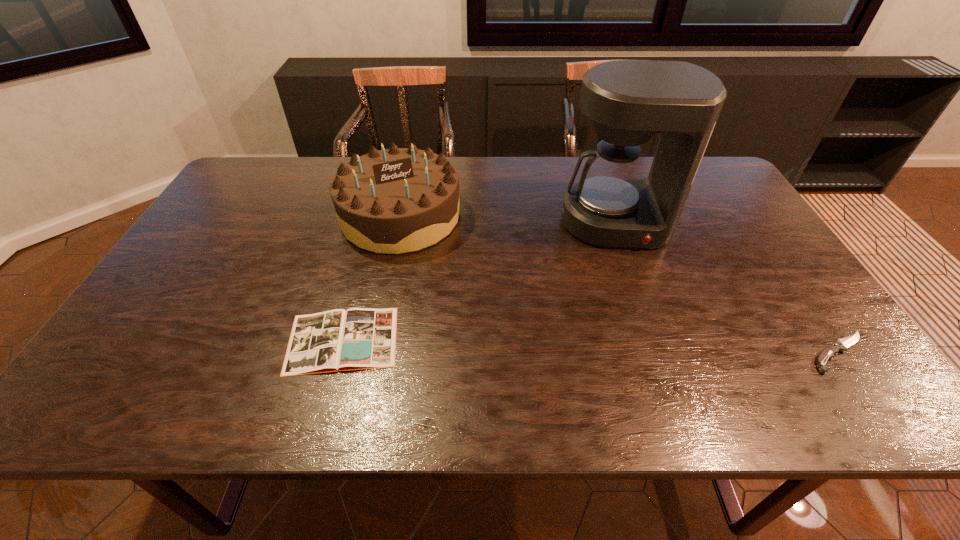
Where is `free space on the desktop that is between the book and the pocketknife and is positioned on the front-facing side of the birthday cake`? The height and width of the screenshot is (540, 960). free space on the desktop that is between the book and the pocketknife and is positioned on the front-facing side of the birthday cake is located at coordinates (552, 345).

Identify the location of vacant space on the desktop that is between the book and the pocketknife and is positioned on the front-facing side of the third object from left to right. (647, 348).